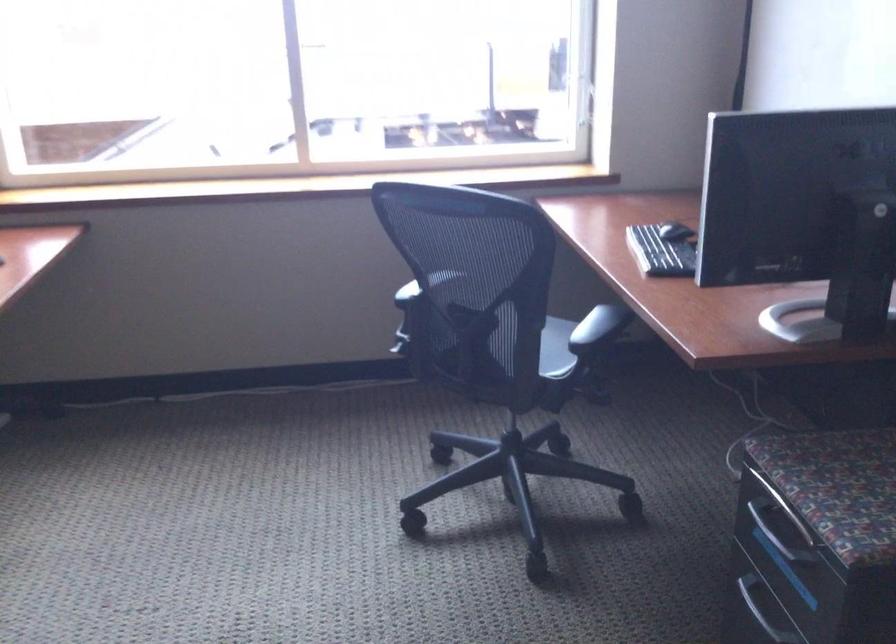
Locate an element on the screen. black computer mouse is located at coordinates (676, 231).